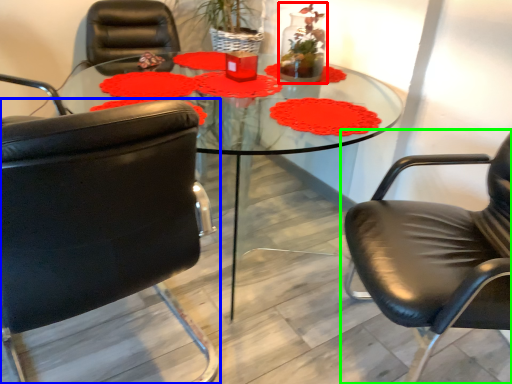
Question: Which object is the closest to the floral arrangement (highlighted by a red box)? Choose among these: chair (highlighted by a blue box) or chair (highlighted by a green box).

Choices:
 (A) chair
 (B) chair

Answer: (B)